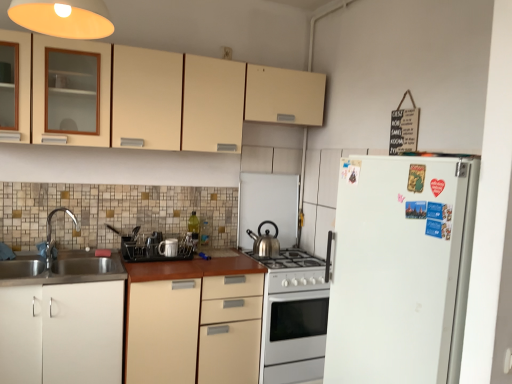
What is the approximate width of polished stainless steel kettle at center?

8.80 inches.

Locate an element on the screen. The image size is (512, 384). black plastic dish rack at center, placed as the 2th appliance when sorted from left to right is located at coordinates (153, 247).

This screenshot has height=384, width=512. Describe the element at coordinates (401, 268) in the screenshot. I see `white matte refrigerator at right` at that location.

This screenshot has height=384, width=512. Identify the location of matte black dish rack at center, positioned as the 4th appliance in right-to-left order. (153, 243).

You are a GUI agent. You are given a task and a screenshot of the screen. Output one action in this format:
    pyautogui.click(x=<x>, y=<y>)
    Task: Click on the white ceramic mug at center, which is counted as the 2th appliance, starting from the right
    This screenshot has height=384, width=512.
    Given the screenshot: What is the action you would take?
    pyautogui.click(x=168, y=247)

I want to click on polished stainless steel kettle at center, so click(x=265, y=241).

Is satin silver kettle at center, positioned as the 4th appliance in left-to-right order, spatially inside brushed metal faucet at left, or outside of it?

satin silver kettle at center, positioned as the 4th appliance in left-to-right order, cannot be found inside brushed metal faucet at left.

Considering the sizes of objects satin silver kettle at center, positioned as the 4th appliance in left-to-right order, and brushed metal faucet at left in the image provided, who is thinner, satin silver kettle at center, positioned as the 4th appliance in left-to-right order, or brushed metal faucet at left?

satin silver kettle at center, positioned as the 4th appliance in left-to-right order, is thinner.

Locate an element on the screen. tap below the satin silver kettle at center, positioned as the 4th appliance in left-to-right order (from the image's perspective) is located at coordinates (51, 230).

Which is more to the right, satin silver kettle at center, arranged as the 1th appliance when viewed from the right, or brushed metal faucet at left?

Positioned to the right is satin silver kettle at center, arranged as the 1th appliance when viewed from the right.

Would you say white matte cabinet at lower left, arranged as the second cabinetry when viewed from the top, is to the left or to the right of polished stainless steel kettle at center in the picture?

white matte cabinet at lower left, arranged as the second cabinetry when viewed from the top, is positioned on polished stainless steel kettle at center's left side.

From a real-world perspective, is white matte cabinet at lower left, arranged as the second cabinetry when viewed from the top, on polished stainless steel kettle at center?

No, from a real-world perspective, white matte cabinet at lower left, arranged as the second cabinetry when viewed from the top, is not over polished stainless steel kettle at center

Is white matte cabinet at lower left, arranged as the second cabinetry when viewed from the top, situated inside polished stainless steel kettle at center or outside?

white matte cabinet at lower left, arranged as the second cabinetry when viewed from the top, is not enclosed by polished stainless steel kettle at center.

Does point (46, 366) come farther from viewer compared to point (275, 237)?

No, it is in front of (275, 237).

Is matte cream cabinets at upper center, which is the third cabinetry in bottom-to-top order, at the back of white glossy oven at center?

That's not correct — white glossy oven at center is not looking away from matte cream cabinets at upper center, which is the third cabinetry in bottom-to-top order.

From a real-world perspective, which object stands above the other?

matte cream cabinets at upper center, the 1th cabinetry in the top-to-bottom sequence.

Between white glossy oven at center and matte cream cabinets at upper center, the 1th cabinetry in the top-to-bottom sequence, which one has larger size?

With larger size is matte cream cabinets at upper center, the 1th cabinetry in the top-to-bottom sequence.

Considering the relative positions of black plastic dish rack at center, placed as the 2th appliance when sorted from left to right, and white glossy gas stove at center in the image provided, is black plastic dish rack at center, placed as the 2th appliance when sorted from left to right, to the left of white glossy gas stove at center from the viewer's perspective?

Indeed, black plastic dish rack at center, placed as the 2th appliance when sorted from left to right, is positioned on the left side of white glossy gas stove at center.

Looking at this image, from the image's perspective, is black plastic dish rack at center, placed as the 2th appliance when sorted from left to right, positioned above or below white glossy gas stove at center?

Based on their image positions, black plastic dish rack at center, placed as the 2th appliance when sorted from left to right, is located above white glossy gas stove at center.

Is black plastic dish rack at center, which is the 3th appliance in right-to-left order, shorter than white glossy gas stove at center?

Yes.

Is black plastic dish rack at center, placed as the 2th appliance when sorted from left to right, turned away from white glossy gas stove at center?

black plastic dish rack at center, placed as the 2th appliance when sorted from left to right, does not have its back to white glossy gas stove at center.

Which object is positioned more to the right, matte cream cabinets at upper center, which is the third cabinetry in bottom-to-top order, or white glossy oven at center?

white glossy oven at center.

Is the position of matte cream cabinets at upper center, which is the third cabinetry in bottom-to-top order, more distant than that of white glossy oven at center?

No, it is not.

From the image's perspective, is matte cream cabinets at upper center, which is the third cabinetry in bottom-to-top order, above or below white glossy oven at center?

From the image's perspective, matte cream cabinets at upper center, which is the third cabinetry in bottom-to-top order, appears above white glossy oven at center.

Does point (230, 86) appear closer or farther from the camera than point (307, 359)?

Point (230, 86) is closer to the camera than point (307, 359).

From a real-world perspective, is polished stainless steel kettle at center under satin silver kettle at center, positioned as the 4th appliance in left-to-right order?

Yes, from a real-world perspective, polished stainless steel kettle at center is beneath satin silver kettle at center, positioned as the 4th appliance in left-to-right order.

Who is more distant, polished stainless steel kettle at center or satin silver kettle at center, arranged as the 1th appliance when viewed from the right?

satin silver kettle at center, arranged as the 1th appliance when viewed from the right, is further from the camera.

Find the location of a particular element. appliance lying above the polished stainless steel kettle at center (from the image's perspective) is located at coordinates (268, 206).

From the picture: Can you tell me how much beige matte cabinet at center, the 1th cabinetry positioned from the bottom, and satin silver kettle at center, arranged as the 1th appliance when viewed from the right, differ in facing direction?

beige matte cabinet at center, the 1th cabinetry positioned from the bottom, and satin silver kettle at center, arranged as the 1th appliance when viewed from the right, are facing 0.000236 degrees away from each other.

In the scene shown: Is beige matte cabinet at center, the 1th cabinetry positioned from the bottom, completely or partially outside of satin silver kettle at center, positioned as the 4th appliance in left-to-right order?

beige matte cabinet at center, the 1th cabinetry positioned from the bottom, lies outside satin silver kettle at center, positioned as the 4th appliance in left-to-right order,'s area.

Consider the image. From a real-world perspective, is beige matte cabinet at center, the 1th cabinetry positioned from the bottom, located higher than satin silver kettle at center, arranged as the 1th appliance when viewed from the right?

Actually, beige matte cabinet at center, the 1th cabinetry positioned from the bottom, is physically below satin silver kettle at center, arranged as the 1th appliance when viewed from the right, in the real world.

Which object is positioned more to the right, beige matte cabinet at center, the 1th cabinetry positioned from the bottom, or satin silver kettle at center, positioned as the 4th appliance in left-to-right order?

From the viewer's perspective, satin silver kettle at center, positioned as the 4th appliance in left-to-right order, appears more on the right side.

Locate an element on the screen. The height and width of the screenshot is (384, 512). tap directly beneath the satin silver kettle at center, positioned as the 4th appliance in left-to-right order (from a real-world perspective) is located at coordinates (51, 230).

Image resolution: width=512 pixels, height=384 pixels. I want to click on kitchen appliance that is above the white matte cabinet at lower left, which is the 2th cabinetry in bottom-to-top order (from a real-world perspective), so click(x=265, y=241).

Considering their positions, is beige matte cabinet at center, the third cabinetry viewed from the top, positioned closer to brushed metal faucet at left than polished stainless steel kettle at center?

beige matte cabinet at center, the third cabinetry viewed from the top, is positioned closer to the anchor brushed metal faucet at left.

When comparing their distances from satin silver kettle at center, arranged as the 1th appliance when viewed from the right, does white glossy gas stove at center or white glossy oven at center seem further?

white glossy oven at center is positioned further to the anchor satin silver kettle at center, arranged as the 1th appliance when viewed from the right.

When comparing their distances from white matte refrigerator at right, does white ceramic mug at center, which is counted as the 2th appliance, starting from the right, or white glossy oven at center seem further?

white ceramic mug at center, which is counted as the 2th appliance, starting from the right, lies further to white matte refrigerator at right than the other object.

From the image, which object appears to be nearer to black plastic dish rack at center, which is the 3th appliance in right-to-left order, white matte refrigerator at right or brushed metal faucet at left?

Based on the image, brushed metal faucet at left appears to be nearer to black plastic dish rack at center, which is the 3th appliance in right-to-left order.

When comparing their distances from white matte cabinet at lower left, which is the 2th cabinetry in bottom-to-top order, does white ceramic mug at center, the third appliance positioned from the left, or white glossy gas stove at center seem further?

Based on the image, white glossy gas stove at center appears to be further to white matte cabinet at lower left, which is the 2th cabinetry in bottom-to-top order.

Looking at this image, from the image, which object appears to be farther from white glossy gas stove at center, white matte cabinet at lower left, arranged as the second cabinetry when viewed from the top, or polished stainless steel kettle at center?

The object further to white glossy gas stove at center is white matte cabinet at lower left, arranged as the second cabinetry when viewed from the top.

From the image, which object appears to be farther from beige matte cabinet at center, the 1th cabinetry positioned from the bottom, matte black dish rack at center, positioned as the first appliance in left-to-right order, or white glossy oven at center?

The object further to beige matte cabinet at center, the 1th cabinetry positioned from the bottom, is matte black dish rack at center, positioned as the first appliance in left-to-right order.

From the image, which object appears to be farther from white glossy gas stove at center, satin silver kettle at center, positioned as the 4th appliance in left-to-right order, or matte black dish rack at center, positioned as the first appliance in left-to-right order?

matte black dish rack at center, positioned as the first appliance in left-to-right order, is further to white glossy gas stove at center.

Image resolution: width=512 pixels, height=384 pixels. In order to click on appliance positioned between white matte refrigerator at right and white glossy gas stove at center from near to far in this screenshot , I will do `click(153, 247)`.

At what (x,y) coordinates should I click in order to perform the action: click on kitchen appliance between matte cream cabinets at upper center, which is the third cabinetry in bottom-to-top order, and matte black dish rack at center, positioned as the first appliance in left-to-right order, in the up-down direction. Please return your answer as a coordinate pair (x, y). The height and width of the screenshot is (384, 512). Looking at the image, I should click on (265, 241).

The height and width of the screenshot is (384, 512). What are the coordinates of `refrigerator that lies between matte cream cabinets at upper center, the 1th cabinetry in the top-to-bottom sequence, and white glossy oven at center from top to bottom` in the screenshot? It's located at (401, 268).

At what (x,y) coordinates should I click in order to perform the action: click on oven between white matte cabinet at lower left, which is the 2th cabinetry in bottom-to-top order, and white matte refrigerator at right. Please return your answer as a coordinate pair (x, y). Image resolution: width=512 pixels, height=384 pixels. Looking at the image, I should click on (294, 326).